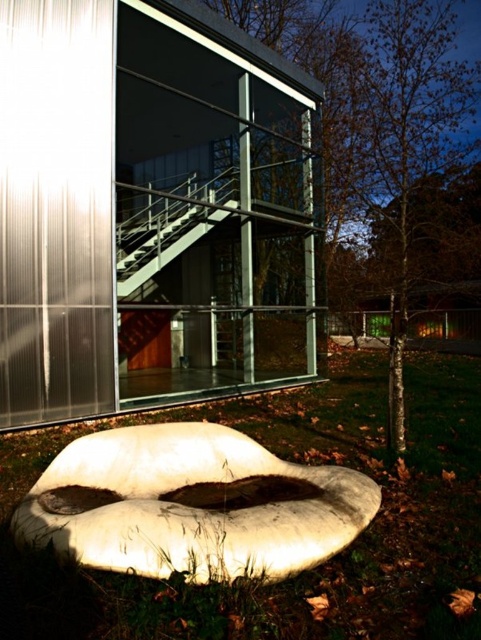
Question: Among these objects, which one is nearest to the camera?

Choices:
 (A) green grass at lower center
 (B) metallic staircase at center

Answer: (A)

Question: Does green grass at lower center appear on the right side of metallic staircase at center?

Choices:
 (A) no
 (B) yes

Answer: (B)

Question: Which point is farther from the camera taking this photo?

Choices:
 (A) (468, 576)
 (B) (219, 211)

Answer: (B)

Question: Is green grass at lower center thinner than metallic staircase at center?

Choices:
 (A) yes
 (B) no

Answer: (B)

Question: Which object is closer to the camera taking this photo?

Choices:
 (A) metallic staircase at center
 (B) green grass at lower center

Answer: (B)

Question: Is green grass at lower center closer to the viewer compared to metallic staircase at center?

Choices:
 (A) no
 (B) yes

Answer: (B)